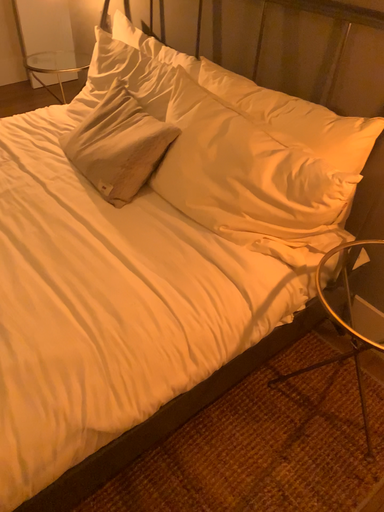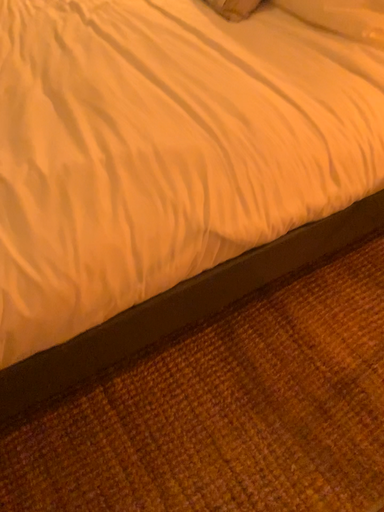
Question: How did the camera likely rotate when shooting the video?

Choices:
 (A) rotated downward
 (B) rotated upward

Answer: (A)